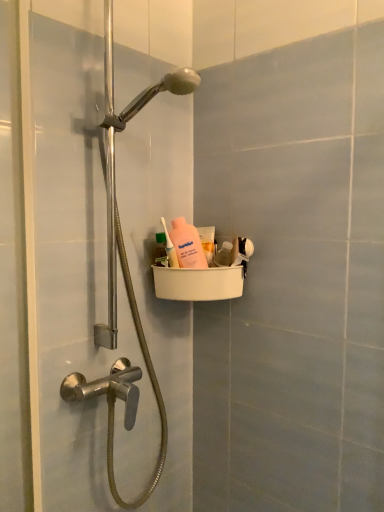
Question: Is pink matte bottle at upper center directly adjacent to white plastic basket at upper center?

Choices:
 (A) no
 (B) yes

Answer: (A)

Question: Can you confirm if pink matte bottle at upper center is smaller than white plastic basket at upper center?

Choices:
 (A) no
 (B) yes

Answer: (B)

Question: Is pink matte bottle at upper center thinner than white plastic basket at upper center?

Choices:
 (A) no
 (B) yes

Answer: (B)

Question: Considering the relative sizes of pink matte bottle at upper center and white plastic basket at upper center in the image provided, is pink matte bottle at upper center shorter than white plastic basket at upper center?

Choices:
 (A) no
 (B) yes

Answer: (B)

Question: From a real-world perspective, is pink matte bottle at upper center located higher than white plastic basket at upper center?

Choices:
 (A) yes
 (B) no

Answer: (A)

Question: From a real-world perspective, is white plastic basket at upper center positioned above or below green plastic bottle at upper center, acting as the first mouthwash starting from the left?

Choices:
 (A) above
 (B) below

Answer: (B)

Question: In the image, is white plastic basket at upper center positioned in front of or behind green plastic bottle at upper center, which is the 2th mouthwash from back to front?

Choices:
 (A) front
 (B) behind

Answer: (A)

Question: Considering the positions of white plastic basket at upper center and green plastic bottle at upper center, the 2th mouthwash in the right-to-left sequence, in the image, is white plastic basket at upper center wider or thinner than green plastic bottle at upper center, the 2th mouthwash in the right-to-left sequence,?

Choices:
 (A) thin
 (B) wide

Answer: (B)

Question: Do you think white plastic basket at upper center is within green plastic bottle at upper center, acting as the first mouthwash starting from the left, or outside of it?

Choices:
 (A) outside
 (B) inside

Answer: (A)

Question: In terms of size, does white plastic basket at upper center appear bigger or smaller than pink matte bottle at upper center?

Choices:
 (A) small
 (B) big

Answer: (B)

Question: Does point (157, 415) appear closer or farther from the camera than point (170, 253)?

Choices:
 (A) closer
 (B) farther

Answer: (B)

Question: From the image's perspective, is white plastic basket at upper center above or below pink matte bottle at upper center?

Choices:
 (A) above
 (B) below

Answer: (B)

Question: Considering the positions of white plastic basket at upper center and pink matte bottle at upper center in the image, is white plastic basket at upper center taller or shorter than pink matte bottle at upper center?

Choices:
 (A) tall
 (B) short

Answer: (A)

Question: In the image, is white plastic basket at upper center positioned in front of or behind pink matte bottle at center, which is the first mouthwash in right-to-left order?

Choices:
 (A) behind
 (B) front

Answer: (B)

Question: Looking at the image, does white plastic basket at upper center seem bigger or smaller compared to pink matte bottle at center, the first mouthwash positioned from the back?

Choices:
 (A) small
 (B) big

Answer: (B)